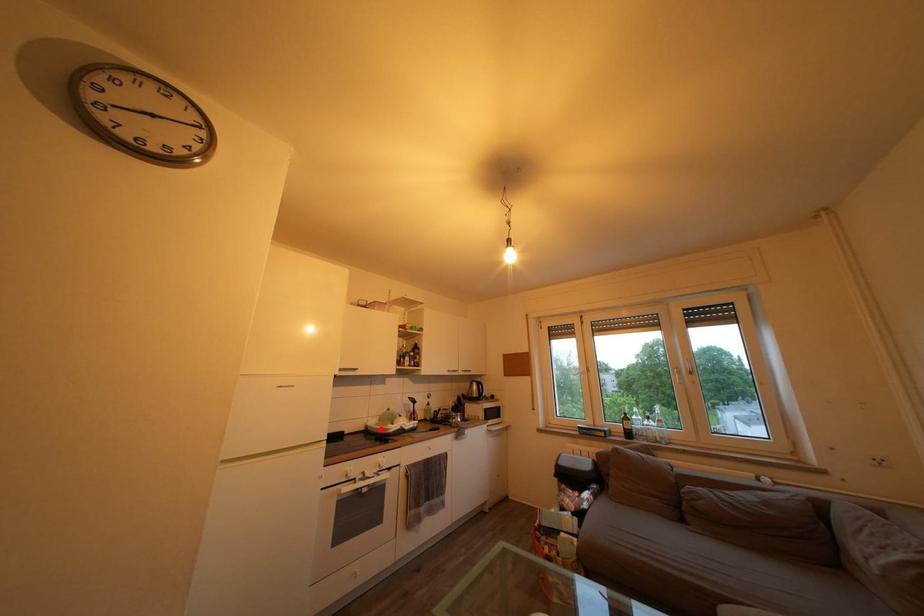
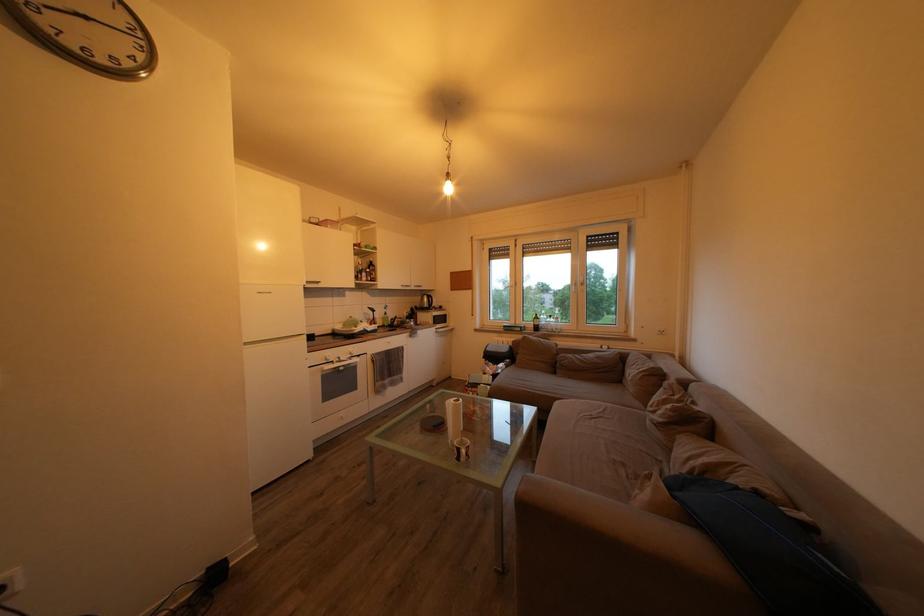
In the second image, find the point that corresponds to the highlighted location in the first image.

(346, 333)